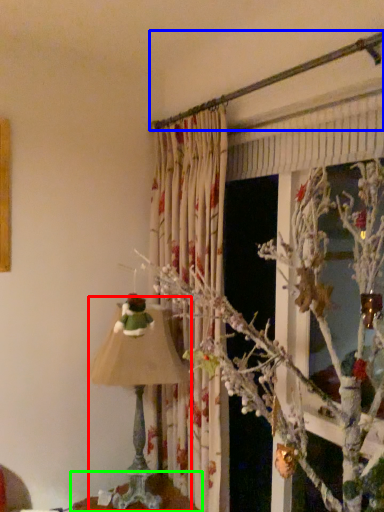
Question: Estimate the real-world distances between objects in this image. Which object is farther from lamp (highlighted by a red box), branch (highlighted by a blue box) or furniture (highlighted by a green box)?

Choices:
 (A) branch
 (B) furniture

Answer: (A)